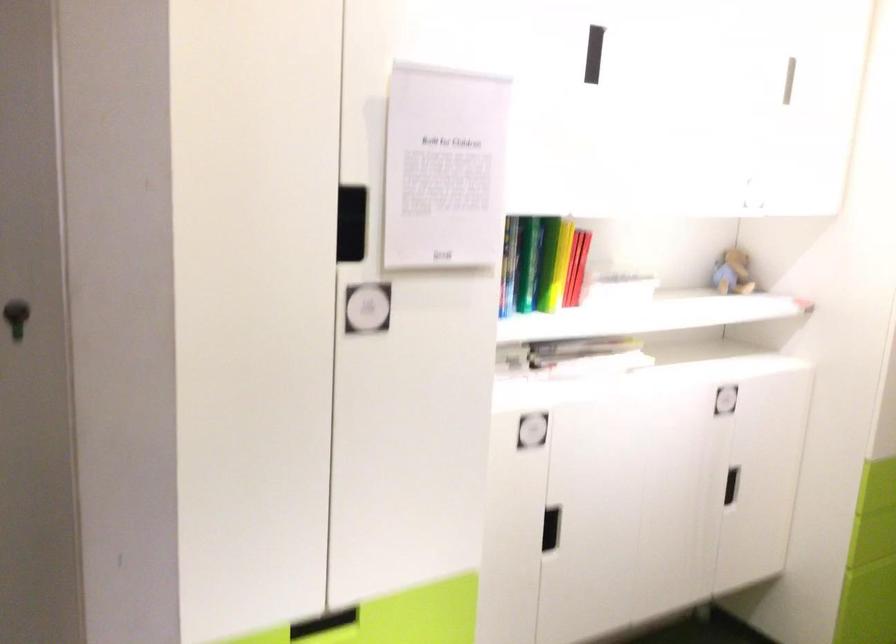
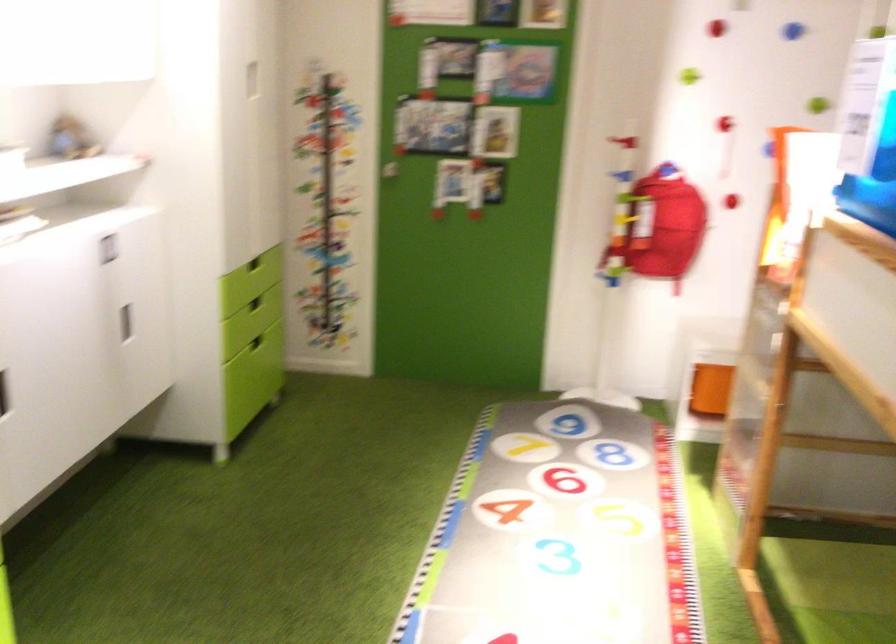
Question: The first image is from the beginning of the video and the second image is from the end. How did the camera likely rotate when shooting the video?

Choices:
 (A) Left
 (B) Right
 (C) Up
 (D) Down

Answer: (B)